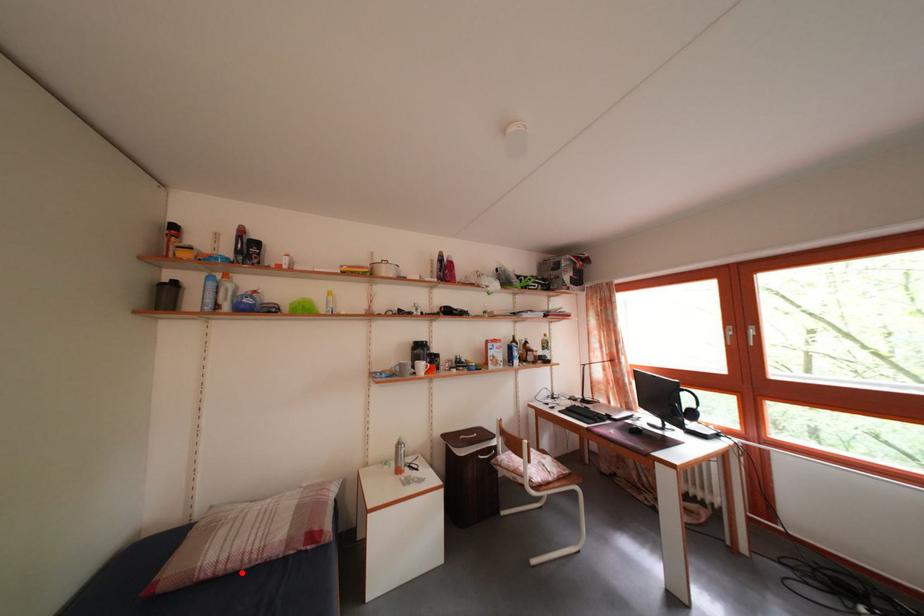
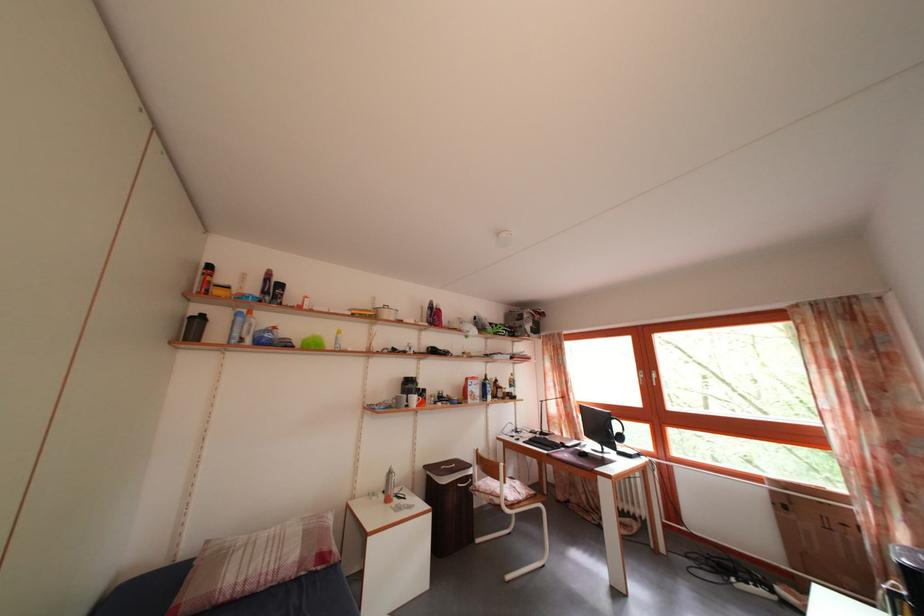
The point at the highlighted location is marked in the first image. Where is the corresponding point in the second image?

(257, 594)